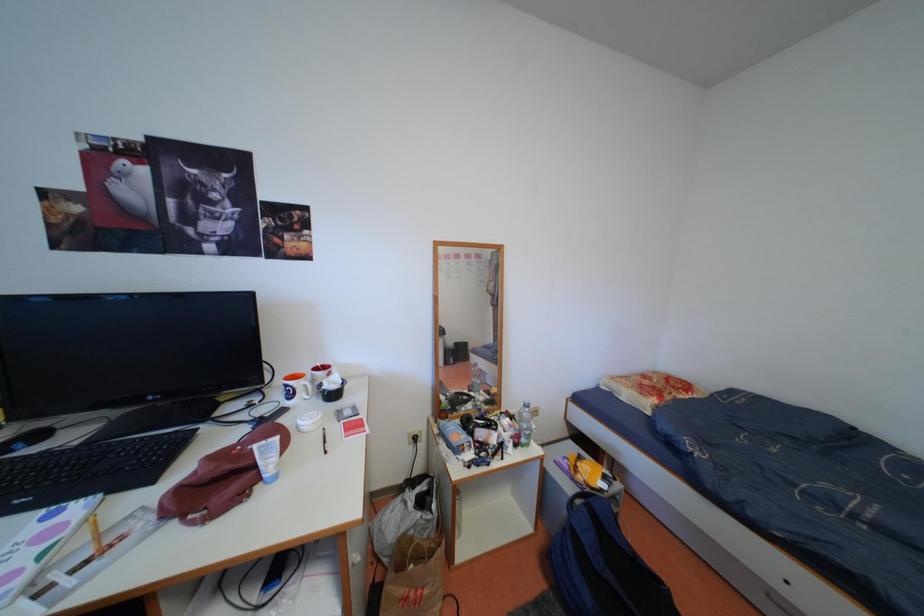
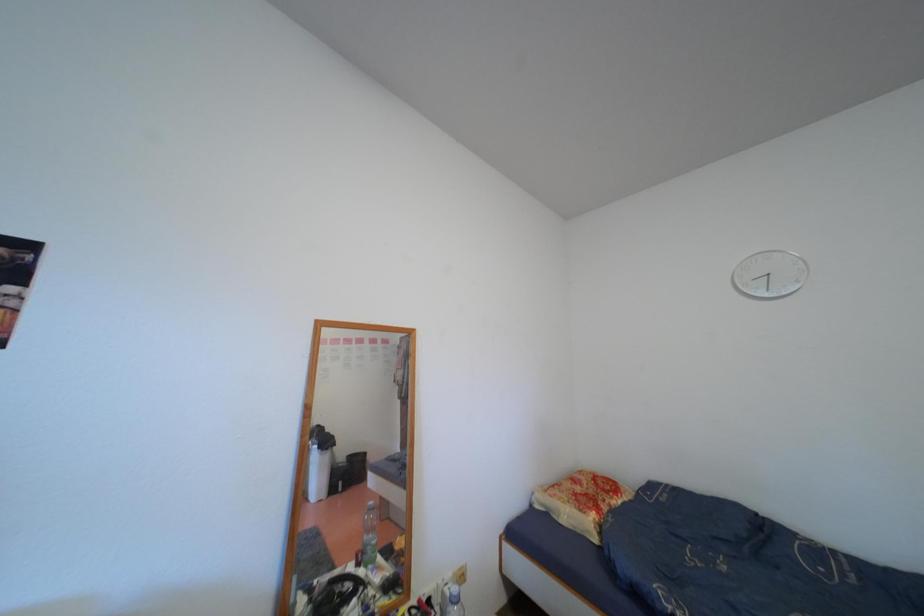
Question: Which direction would the cameraman need to move to produce the second image? Reply with the corresponding letter.

Choices:
 (A) Left
 (B) Right
 (C) Forward
 (D) Backward

Answer: (C)